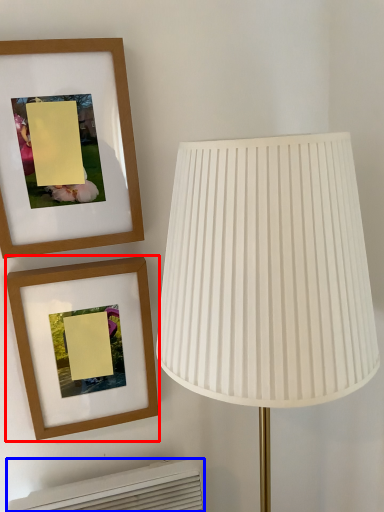
Question: Among these objects, which one is nearest to the camera, picture frame (highlighted by a red box) or air conditioner (highlighted by a blue box)?

Choices:
 (A) picture frame
 (B) air conditioner

Answer: (A)